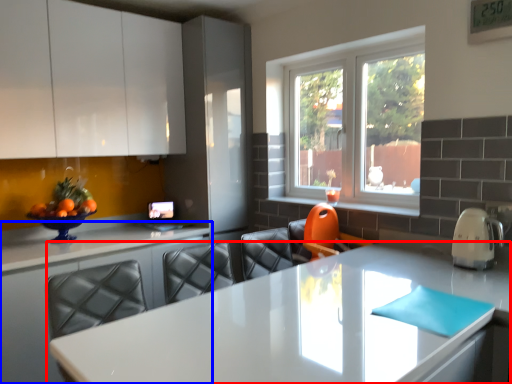
Question: Among these objects, which one is farthest to the camera, countertop (highlighted by a red box) or countertop (highlighted by a blue box)?

Choices:
 (A) countertop
 (B) countertop

Answer: (B)